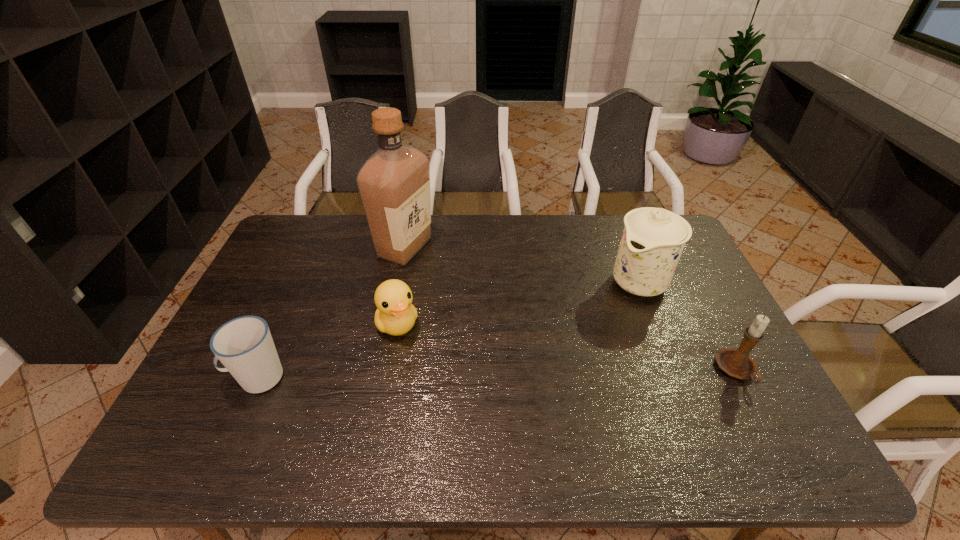
In order to click on vacant space located 0.230m on the spout of the chinaware in this screenshot , I will do `click(577, 338)`.

Image resolution: width=960 pixels, height=540 pixels. I want to click on free space located 0.070m on the spout of the chinaware, so click(610, 309).

At what (x,y) coordinates should I click in order to perform the action: click on blank area located on the spout of the chinaware. Please return your answer as a coordinate pair (x, y). Image resolution: width=960 pixels, height=540 pixels. Looking at the image, I should click on (559, 354).

Where is `free spot located 0.160m on the face of the third farthest object`? Image resolution: width=960 pixels, height=540 pixels. free spot located 0.160m on the face of the third farthest object is located at coordinates (431, 383).

The image size is (960, 540). I want to click on vacant space situated on the face of the third farthest object, so click(x=445, y=407).

Identify the location of vacant space located on the face of the third farthest object. (418, 361).

Identify the location of object situated at the far edge. The height and width of the screenshot is (540, 960). (394, 183).

The width and height of the screenshot is (960, 540). In order to click on cup that is positioned at the near edge in this screenshot , I will do `click(244, 345)`.

Image resolution: width=960 pixels, height=540 pixels. What are the coordinates of `candle holder that is positioned at the near edge` in the screenshot? It's located at (737, 363).

You are a GUI agent. You are given a task and a screenshot of the screen. Output one action in this format:
    pyautogui.click(x=<x>, y=<y>)
    Task: Click on the object situated at the left edge
    This screenshot has width=960, height=540.
    Given the screenshot: What is the action you would take?
    pyautogui.click(x=244, y=345)